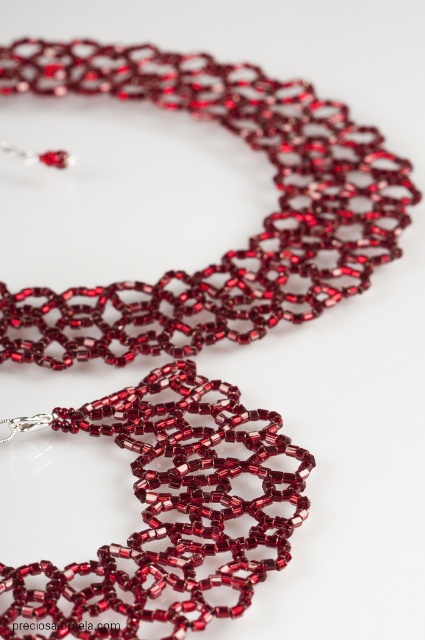
Is matte glass necklace at upper center closer to the viewer compared to matte glass beaded necklace at center?

No.

Is point (124, 314) positioned after point (175, 428)?

Yes, point (124, 314) is behind point (175, 428).

Where is `matte glass necklace at upper center`? matte glass necklace at upper center is located at coordinates (252, 236).